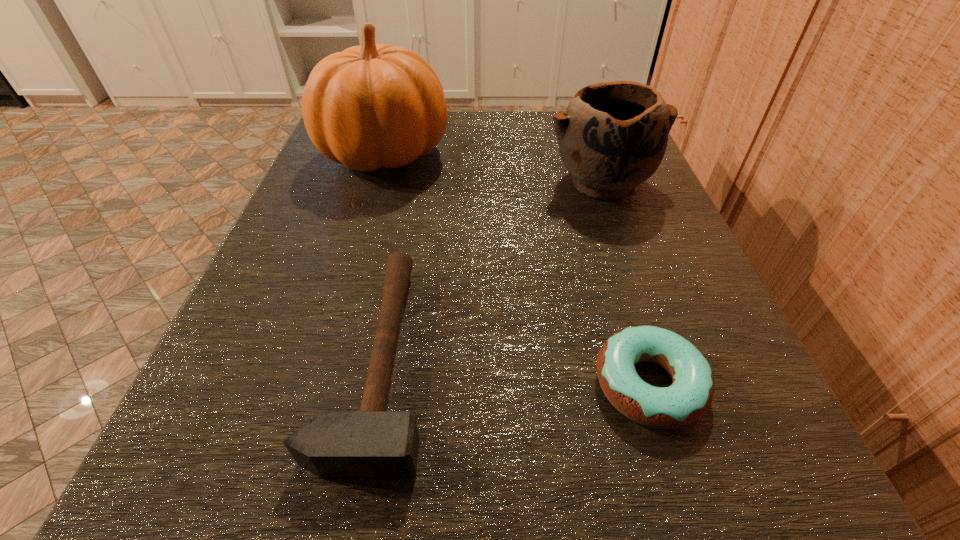
What are the coordinates of `pumpkin` in the screenshot? It's located at (371, 106).

Identify the location of the third shortest object. (612, 137).

Find the location of `hammer`. hammer is located at coordinates (371, 444).

Find the location of a particular element. This screenshot has width=960, height=540. the shortest object is located at coordinates (689, 397).

You are a GUI agent. You are given a task and a screenshot of the screen. Output one action in this format:
    pyautogui.click(x=<x>, y=<y>)
    Task: Click on the vacant position located 0.260m on the front of the tallest object
    
    Given the screenshot: What is the action you would take?
    pyautogui.click(x=341, y=308)

This screenshot has width=960, height=540. Identify the location of vacant space situated 0.100m on the back of the pottery. (584, 132).

The width and height of the screenshot is (960, 540). What are the coordinates of `vacant area situated on the striking surface of the second shortest object` in the screenshot? It's located at (585, 359).

This screenshot has height=540, width=960. I want to click on free space located on the back of the shortest object, so click(x=620, y=291).

Where is `pumpkin that is at the far edge`? The image size is (960, 540). pumpkin that is at the far edge is located at coordinates (371, 106).

The width and height of the screenshot is (960, 540). I want to click on pottery at the far edge, so click(612, 137).